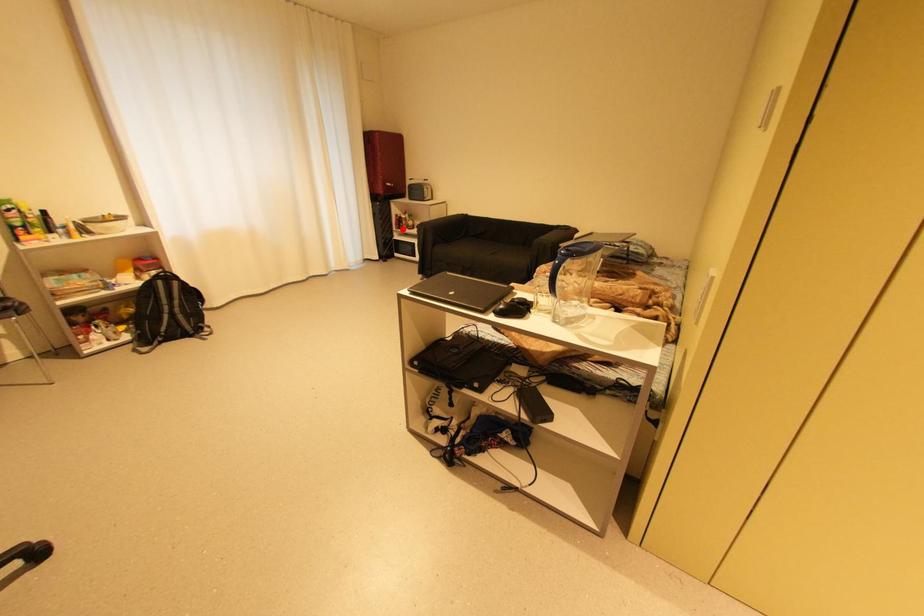
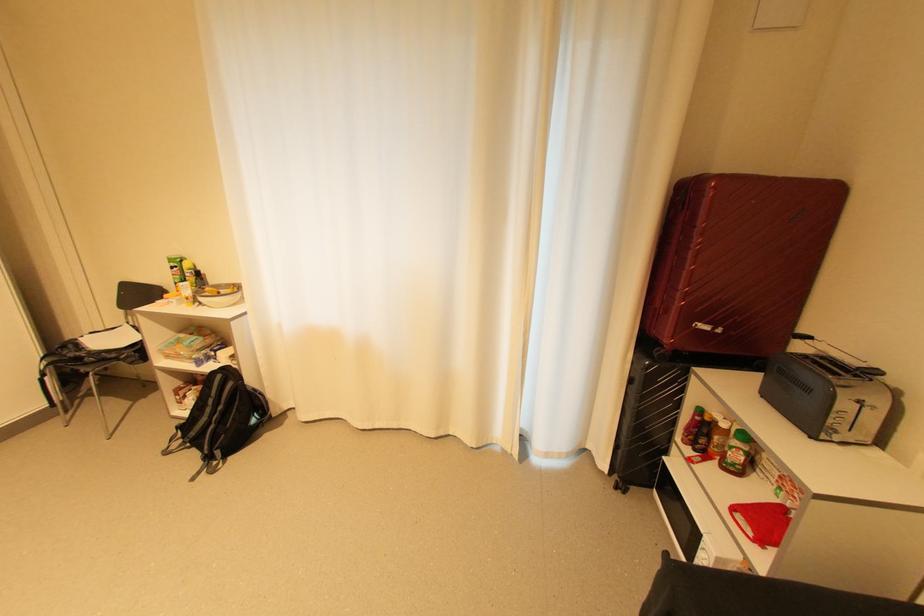
The point at the highlighted location is marked in the first image. Where is the corresponding point in the second image?

(686, 439)